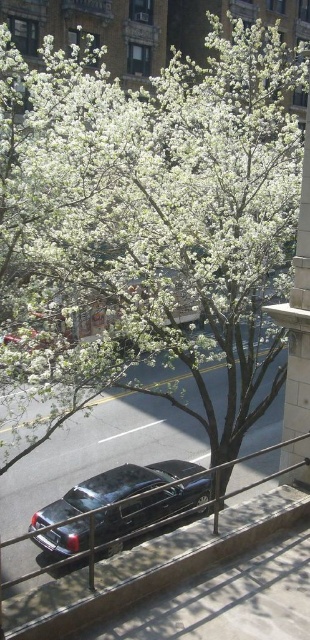
Who is lower down, metallic gray rail at lower center or shiny black car at center?

shiny black car at center

Is metallic gray rail at lower center below shiny black car at center?

No.

Where is `metallic gray rail at lower center`? The width and height of the screenshot is (310, 640). metallic gray rail at lower center is located at coordinates (150, 566).